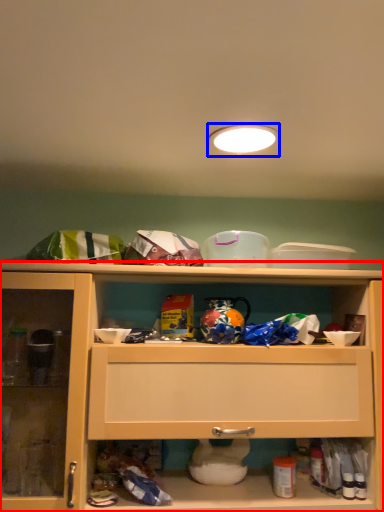
Question: Which object appears farthest to the camera in this image, cabinetry (highlighted by a red box) or lighting (highlighted by a blue box)?

Choices:
 (A) cabinetry
 (B) lighting

Answer: (A)